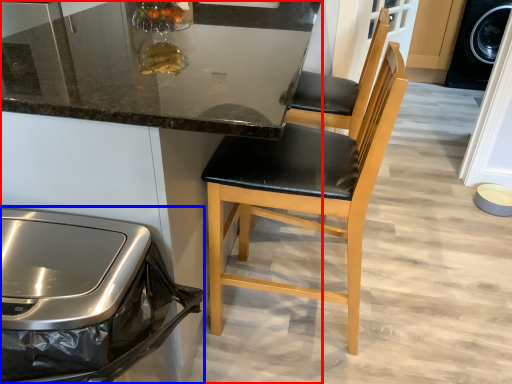
Question: Which object appears closest to the camera in this image, cabinetry (highlighted by a red box) or home appliance (highlighted by a blue box)?

Choices:
 (A) cabinetry
 (B) home appliance

Answer: (B)